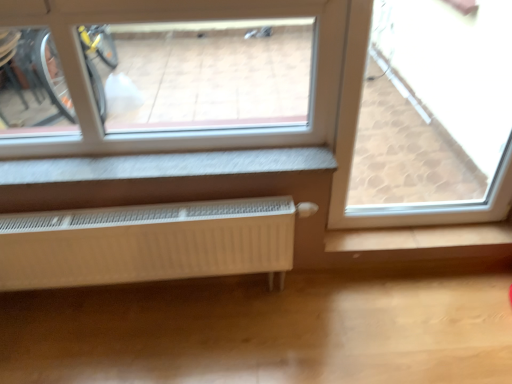
What do you see at coordinates (146, 243) in the screenshot?
I see `white matte radiator at lower center` at bounding box center [146, 243].

Where is `white matte radiator at lower center`? Image resolution: width=512 pixels, height=384 pixels. white matte radiator at lower center is located at coordinates (146, 243).

The image size is (512, 384). What do you see at coordinates (354, 145) in the screenshot? I see `transparent glass window at upper right` at bounding box center [354, 145].

What is the approximate width of transparent glass window at upper right?

It is 5.51 inches.

In order to click on transparent glass window at upper right in this screenshot , I will do tap(354, 145).

Where is `white matte radiator at lower center`? The height and width of the screenshot is (384, 512). white matte radiator at lower center is located at coordinates (146, 243).

Is white matte radiator at lower center to the right of transparent glass window at upper right from the viewer's perspective?

In fact, white matte radiator at lower center is to the left of transparent glass window at upper right.

Looking at this image, considering the relative positions of white matte radiator at lower center and transparent glass window at upper right in the image provided, is white matte radiator at lower center behind transparent glass window at upper right?

Yes, white matte radiator at lower center is behind transparent glass window at upper right.

Is point (281, 260) closer to camera compared to point (338, 163)?

Yes, point (281, 260) is closer to viewer.

From the image's perspective, is white matte radiator at lower center under transparent glass window at upper right?

Indeed, from the image's perspective, white matte radiator at lower center is shown beneath transparent glass window at upper right.

From a real-world perspective, who is located lower, white matte radiator at lower center or transparent glass window at upper right?

white matte radiator at lower center is physically lower.

Is white matte radiator at lower center thinner than transparent glass window at upper right?

Correct, the width of white matte radiator at lower center is less than that of transparent glass window at upper right.

Considering the sizes of white matte radiator at lower center and transparent glass window at upper right in the image, is white matte radiator at lower center taller or shorter than transparent glass window at upper right?

white matte radiator at lower center is shorter than transparent glass window at upper right.

Considering the sizes of objects white matte radiator at lower center and transparent glass window at upper right in the image provided, who is smaller, white matte radiator at lower center or transparent glass window at upper right?

white matte radiator at lower center.

Would you say white matte radiator at lower center is outside transparent glass window at upper right?

Indeed, white matte radiator at lower center is completely outside transparent glass window at upper right.

Is white matte radiator at lower center next to transparent glass window at upper right and touching it?

No, white matte radiator at lower center is not with transparent glass window at upper right.

Is white matte radiator at lower center aimed at transparent glass window at upper right?

No, white matte radiator at lower center does not turn towards transparent glass window at upper right.

Image resolution: width=512 pixels, height=384 pixels. What are the coordinates of `window that is above the white matte radiator at lower center (from a real-world perspective)` in the screenshot? It's located at (354, 145).

Would you say transparent glass window at upper right is to the left or to the right of white matte radiator at lower center in the picture?

transparent glass window at upper right is positioned on white matte radiator at lower center's right side.

Does transparent glass window at upper right lie behind white matte radiator at lower center?

That is False.

Does point (496, 197) come in front of point (224, 244)?

No, (496, 197) is behind (224, 244).

From the image's perspective, which one is positioned lower, transparent glass window at upper right or white matte radiator at lower center?

white matte radiator at lower center, from the image's perspective.

From a real-world perspective, is transparent glass window at upper right over white matte radiator at lower center?

Yes, from a real-world perspective, transparent glass window at upper right is on top of white matte radiator at lower center.

Which of these two, transparent glass window at upper right or white matte radiator at lower center, is wider?

With larger width is transparent glass window at upper right.

Consider the image. In terms of height, does transparent glass window at upper right look taller or shorter compared to white matte radiator at lower center?

Clearly, transparent glass window at upper right is taller compared to white matte radiator at lower center.

Looking at the image, does transparent glass window at upper right seem bigger or smaller compared to white matte radiator at lower center?

In the image, transparent glass window at upper right appears to be larger than white matte radiator at lower center.

Is white matte radiator at lower center inside transparent glass window at upper right?

Definitely not — white matte radiator at lower center is not inside transparent glass window at upper right.

Does transparent glass window at upper right touch white matte radiator at lower center?

No.

Is white matte radiator at lower center at the back of transparent glass window at upper right?

transparent glass window at upper right does not have its back to white matte radiator at lower center.

From the picture: What's the angular difference between transparent glass window at upper right and white matte radiator at lower center's facing directions?

There is a 2.05-degree angle between the facing directions of transparent glass window at upper right and white matte radiator at lower center.

At what (x,y) coordinates should I click in order to perform the action: click on window above the white matte radiator at lower center (from the image's perspective). Please return your answer as a coordinate pair (x, y). Looking at the image, I should click on (354, 145).

Locate an element on the screen. This screenshot has width=512, height=384. window above the white matte radiator at lower center (from the image's perspective) is located at coordinates (354, 145).

I want to click on radiator lying on the left of transparent glass window at upper right, so tap(146, 243).